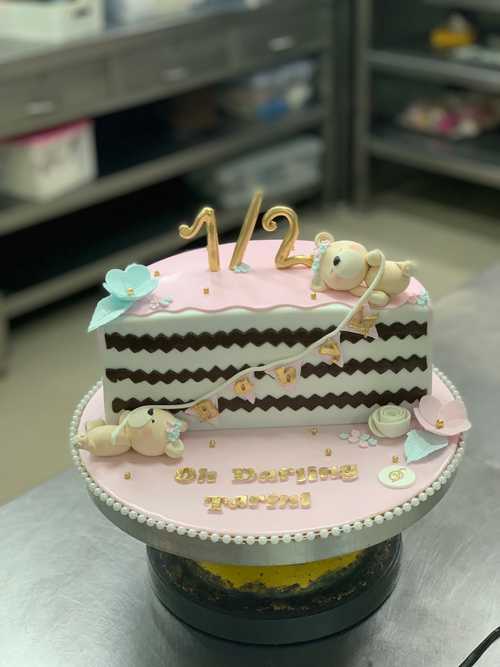
Locate an element on the screen. This screenshot has width=500, height=667. pink surface is located at coordinates (245, 291).